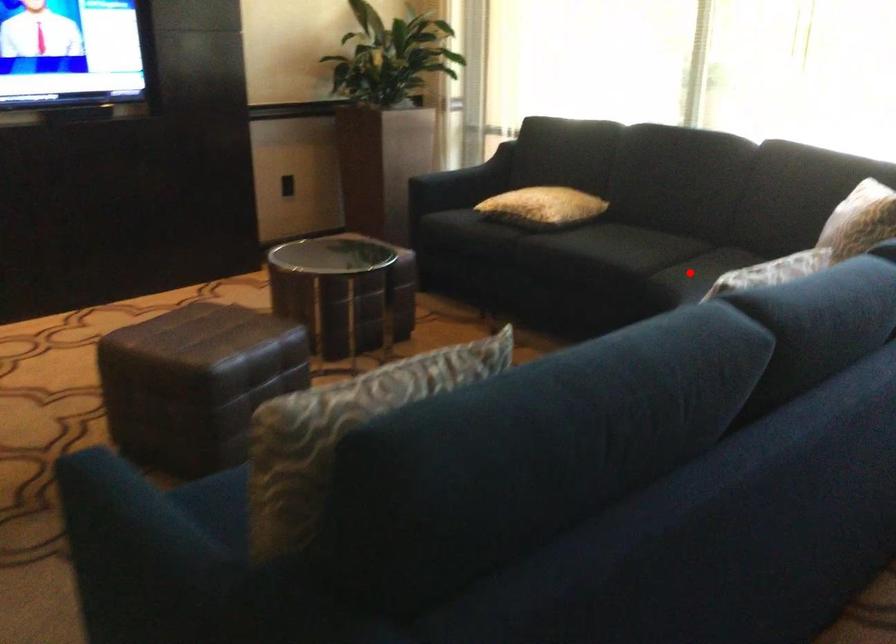
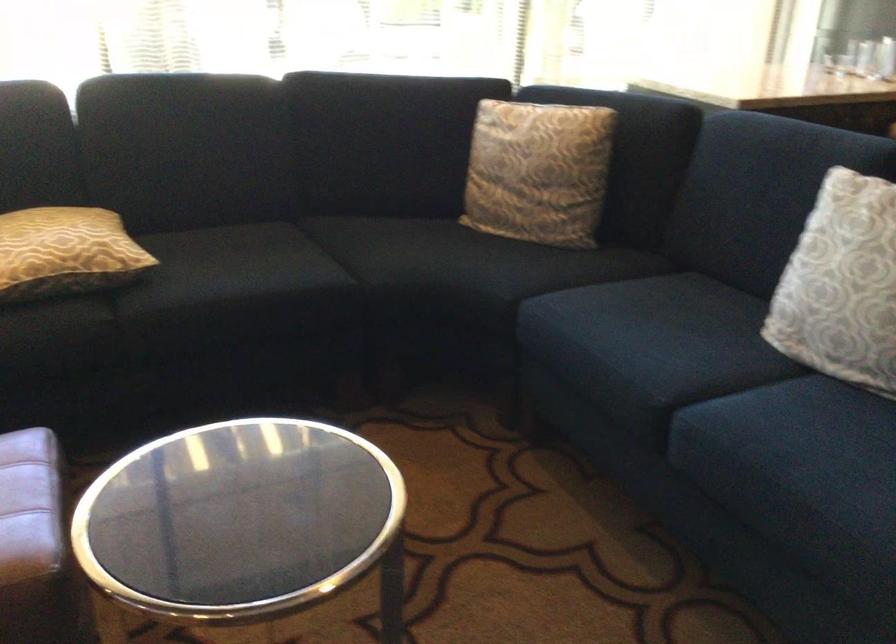
Locate, in the second image, the point that corresponds to the highlighted location in the first image.

(391, 261)